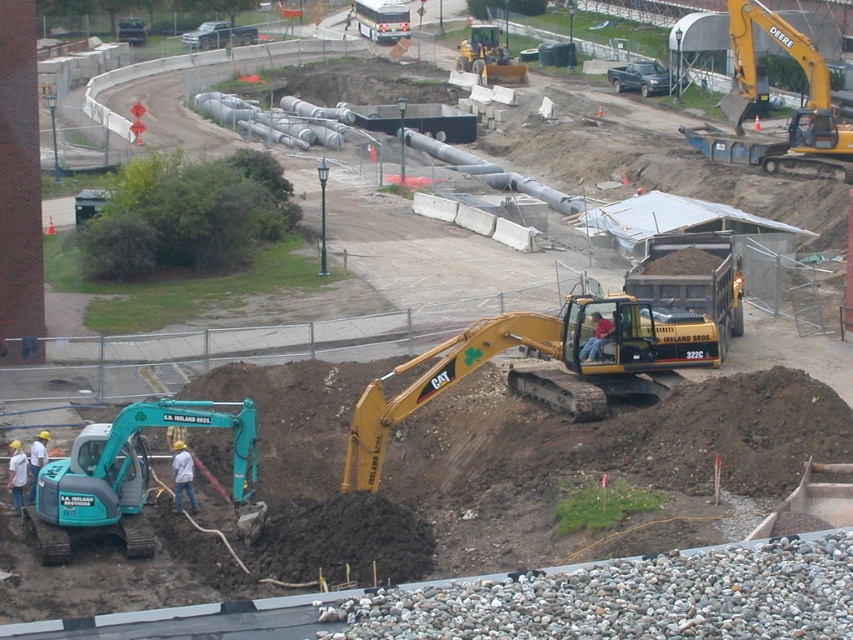
You are standing at the construction site and want to place a safety barrier 25 meters away from the brown soil at lower left to ensure worker safety. Can you estimate whether the barrier will be placed beyond the current visible area?

The brown soil at lower left is 23.92 meters away from the viewer. Placing the safety barrier 25 meters away from the brown soil at lower left would place it at a total distance of 23.92m plus 25m equals 48.92 meters from the viewer. Since the question doesn not provide information about the total visible area, it is impossible to determine if the barrier will be beyond the current visible area.

Looking at this image, you are a construction worker who needs to move a heavy object from the yellow metallic excavator at center to the light blue jeans at lower left. Considering their sizes, which object has a larger width that might make it easier to place the object on it?

The yellow metallic excavator at center has a larger width than the light blue jeans at lower left, so placing the object on the yellow metallic excavator at center would be easier due to its greater width.